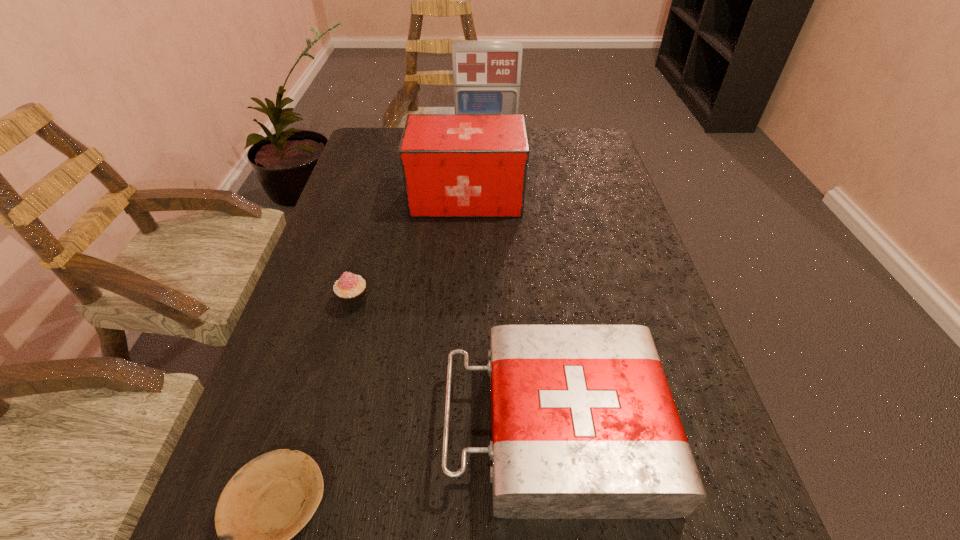
This screenshot has height=540, width=960. Identify the location of the farthest object. (486, 74).

At what (x,y) coordinates should I click in order to perform the action: click on the tallest first-aid kit. Please return your answer as a coordinate pair (x, y). Looking at the image, I should click on (486, 74).

This screenshot has height=540, width=960. In order to click on the fourth shortest object in this screenshot , I will do `click(454, 165)`.

Locate an element on the screen. Image resolution: width=960 pixels, height=540 pixels. the second tallest first-aid kit is located at coordinates (454, 165).

Where is `the shortest first-aid kit`? the shortest first-aid kit is located at coordinates point(584,426).

Find the location of a particular element. The height and width of the screenshot is (540, 960). cupcake is located at coordinates pyautogui.click(x=350, y=289).

Where is `vacant space situated 0.090m on the front-facing side of the tallest first-aid kit`? vacant space situated 0.090m on the front-facing side of the tallest first-aid kit is located at coordinates (487, 166).

Identify the location of free region located 0.230m on the handle side of the second farthest object. (610, 197).

What are the coordinates of `free space located 0.080m on the front side of the nearest first-aid kit` in the screenshot? It's located at (398, 427).

Find the location of `free space located 0.290m on the front side of the nearest first-aid kit`. free space located 0.290m on the front side of the nearest first-aid kit is located at coordinates (269, 427).